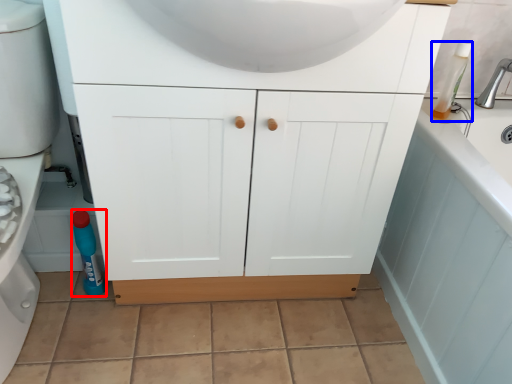
Question: Which object appears closest to the camera in this image, bottle (highlighted by a red box) or cleaning product (highlighted by a blue box)?

Choices:
 (A) bottle
 (B) cleaning product

Answer: (B)